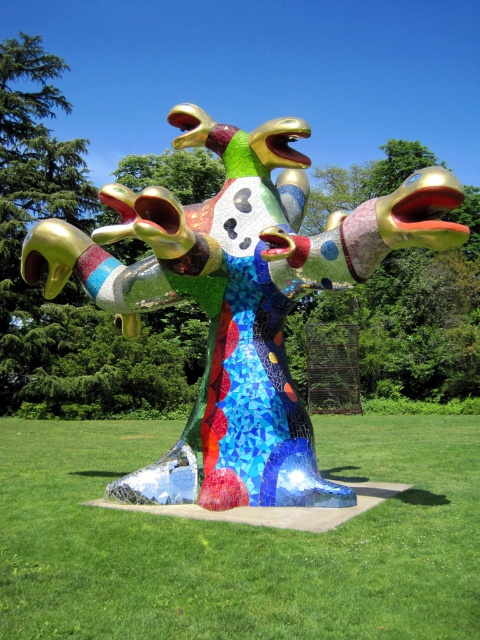
Question: From the image, what is the correct spatial relationship of mosaic sculpture at center in relation to mosaic multicolored sculpture at center?

Choices:
 (A) above
 (B) below

Answer: (B)

Question: Which of the following is the farthest from the observer?

Choices:
 (A) tap(46, 545)
 (B) tap(136, 269)

Answer: (B)

Question: Among these points, which one is nearest to the camera?

Choices:
 (A) (434, 474)
 (B) (211, 257)

Answer: (B)

Question: Is mosaic sculpture at center positioned at the back of mosaic multicolored sculpture at center?

Choices:
 (A) no
 (B) yes

Answer: (A)

Question: Is mosaic sculpture at center bigger than mosaic multicolored sculpture at center?

Choices:
 (A) yes
 (B) no

Answer: (A)